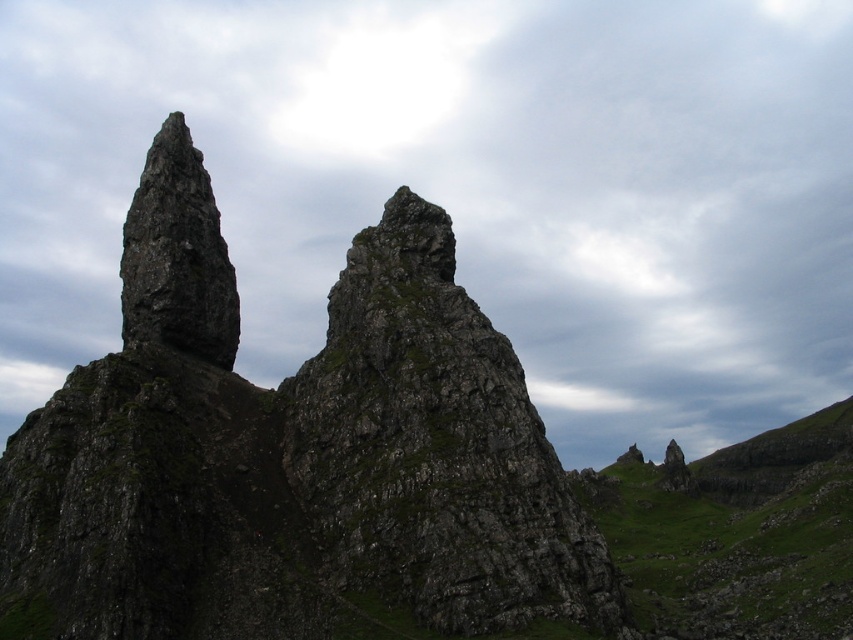
You are an explorer assessing the weather conditions from the image. The scene has a gray cloudy sky at upper center and a green grassy hillside at upper center. Which of these two elements occupies a larger horizontal space in the image?

The gray cloudy sky at upper center has a greater width than the green grassy hillside at upper center, so it occupies a larger horizontal space in the image.

You are a hiker standing at the base of the rough stone rock at center and looking towards the gray cloudy sky at upper center. Which object is higher in your field of view?

The gray cloudy sky at upper center is higher in your field of view because it is positioned over the rough stone rock at center.